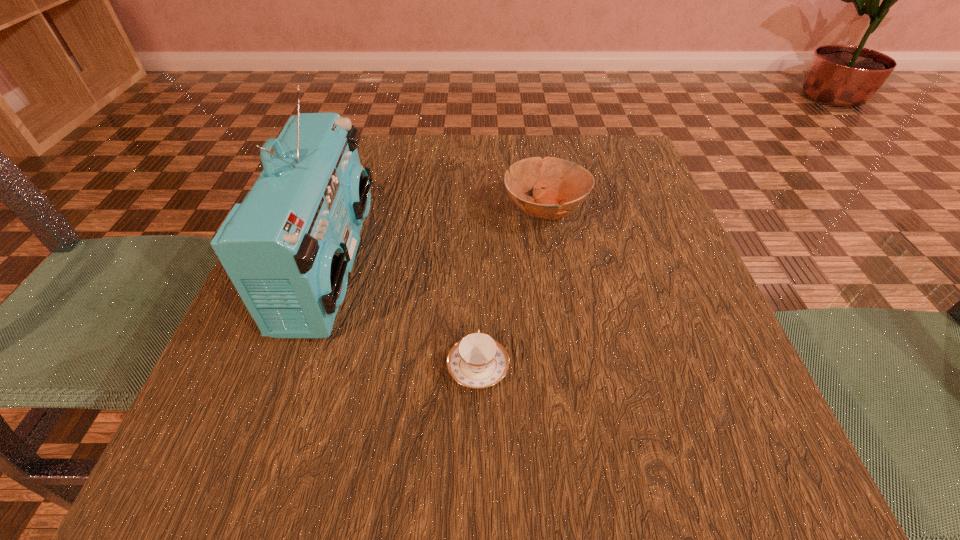
You are a GUI agent. You are given a task and a screenshot of the screen. Output one action in this format:
    pyautogui.click(x=<x>, y=<y>)
    Task: Click on the free space that satisfies the following two spatial constraints: 1. on the front-facing side of the radio receiver; 2. on the side with the handle of the shortest object
    The width and height of the screenshot is (960, 540).
    Given the screenshot: What is the action you would take?
    pyautogui.click(x=296, y=367)

The image size is (960, 540). I want to click on free space that satisfies the following two spatial constraints: 1. on the side with the handle of the second object from right to left; 2. on the front-facing side of the tallest object, so click(x=478, y=265).

Identify the location of vacant space that satisfies the following two spatial constraints: 1. on the side with the handle of the shortest object; 2. on the front-facing side of the tallest object. (478, 265).